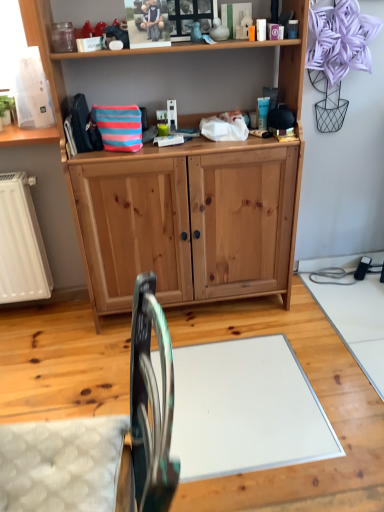
Question: From a real-world perspective, is natural wood cabinet at center above or below metallic teal swivel chair at lower left?

Choices:
 (A) above
 (B) below

Answer: (A)

Question: Is natural wood cabinet at center bigger or smaller than metallic teal swivel chair at lower left?

Choices:
 (A) small
 (B) big

Answer: (B)

Question: From the image's perspective, is natural wood cabinet at center positioned above or below metallic teal swivel chair at lower left?

Choices:
 (A) above
 (B) below

Answer: (A)

Question: Would you say metallic teal swivel chair at lower left is to the left or to the right of natural wood cabinet at center in the picture?

Choices:
 (A) left
 (B) right

Answer: (A)

Question: Is metallic teal swivel chair at lower left inside or outside of natural wood cabinet at center?

Choices:
 (A) outside
 (B) inside

Answer: (A)

Question: In terms of size, does metallic teal swivel chair at lower left appear bigger or smaller than natural wood cabinet at center?

Choices:
 (A) big
 (B) small

Answer: (B)

Question: From a real-world perspective, relative to natural wood cabinet at center, is metallic teal swivel chair at lower left vertically above or below?

Choices:
 (A) below
 (B) above

Answer: (A)